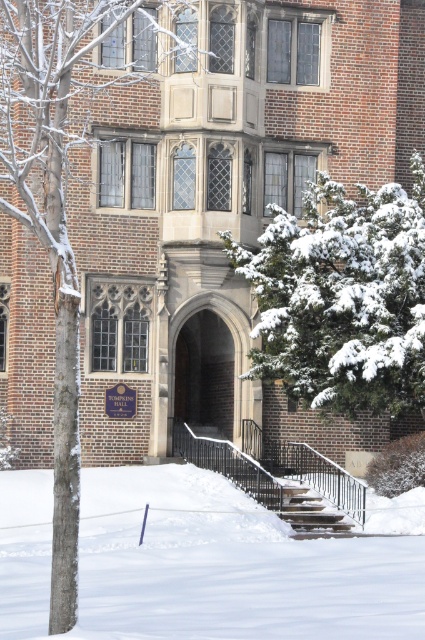
Question: Which object appears farthest from the camera in this image?

Choices:
 (A) white fluffy snow at lower center
 (B) snow-covered evergreen tree at center

Answer: (B)

Question: Which of the following is the closest to the observer?

Choices:
 (A) pyautogui.click(x=22, y=600)
 (B) pyautogui.click(x=23, y=161)
 (C) pyautogui.click(x=382, y=234)

Answer: (A)

Question: Considering the real-world distances, which object is closest to the snow-covered tree trunk at left?

Choices:
 (A) white fluffy snow at lower center
 (B) metallic gray staircase at center
 (C) snow-covered evergreen tree at center

Answer: (A)

Question: Does white fluffy snow at lower center have a lesser width compared to snow-covered evergreen tree at center?

Choices:
 (A) no
 (B) yes

Answer: (A)

Question: Does snow-covered evergreen tree at center appear over snow-covered tree trunk at left?

Choices:
 (A) no
 (B) yes

Answer: (B)

Question: Is white fluffy snow at lower center smaller than metallic gray staircase at center?

Choices:
 (A) yes
 (B) no

Answer: (B)